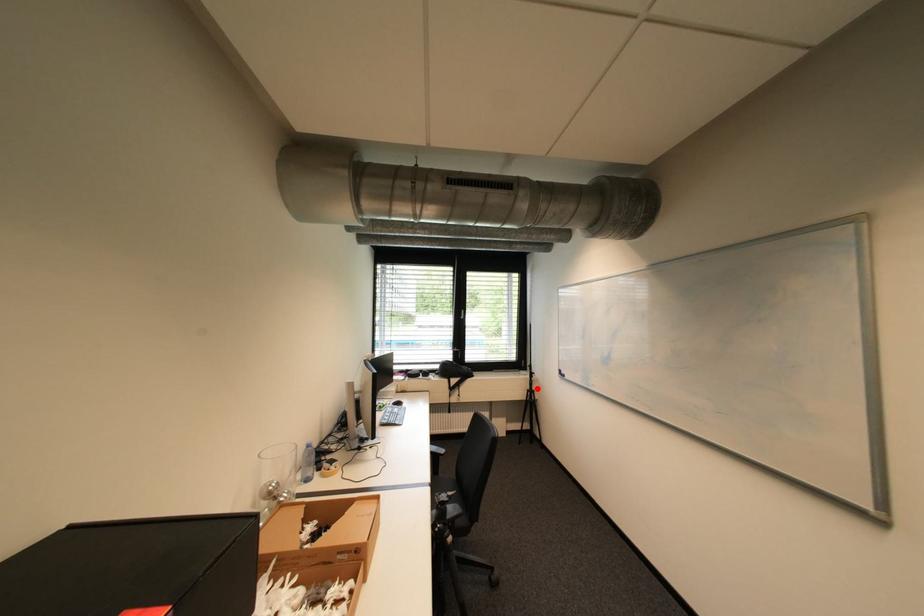
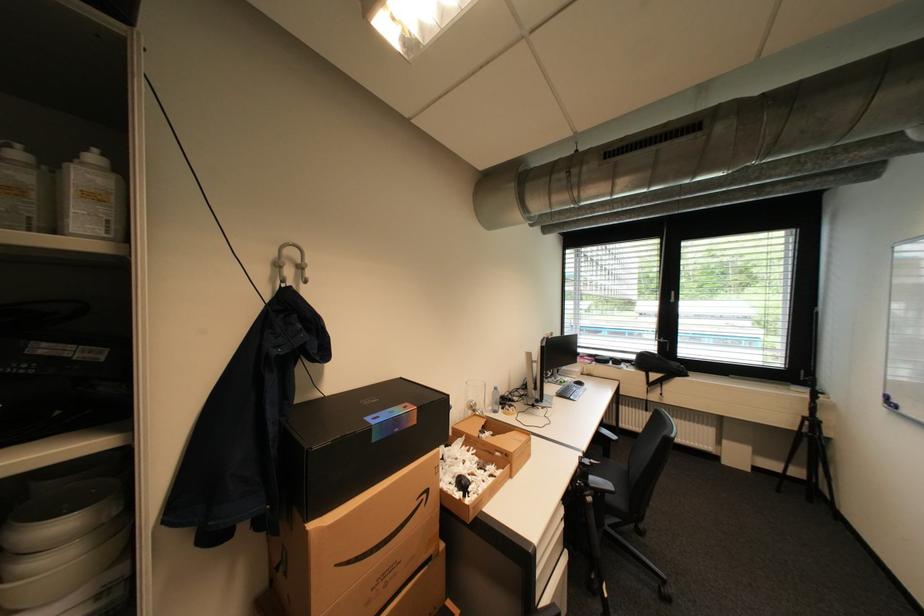
Find the pixel in the second image that matches the highlighted location in the first image.

(815, 415)